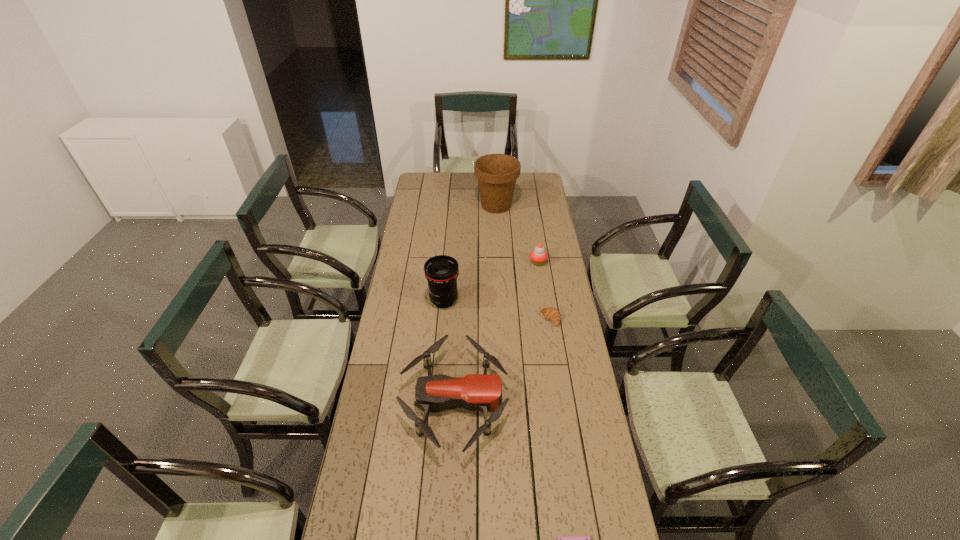
The width and height of the screenshot is (960, 540). I want to click on flowerpot, so click(496, 173).

I want to click on the farthest object, so click(x=496, y=173).

Where is `telephoto lens`? The image size is (960, 540). telephoto lens is located at coordinates (441, 272).

This screenshot has width=960, height=540. Find the location of `the fifth nearest object`. the fifth nearest object is located at coordinates (538, 256).

Find the location of a particular element. the second nearest object is located at coordinates (475, 392).

The image size is (960, 540). What are the coordinates of `the second shortest object` in the screenshot? It's located at (552, 314).

Identify the location of vacant space situated 0.190m on the front of the farthest object. (498, 239).

The height and width of the screenshot is (540, 960). Identify the location of vacant space located on the back of the fifth shortest object. (445, 278).

What are the coordinates of `free location located on the front of the fifth nearest object` in the screenshot? It's located at (546, 315).

Find the location of `vacant region located 0.210m on the front-facing side of the drone`. vacant region located 0.210m on the front-facing side of the drone is located at coordinates (567, 400).